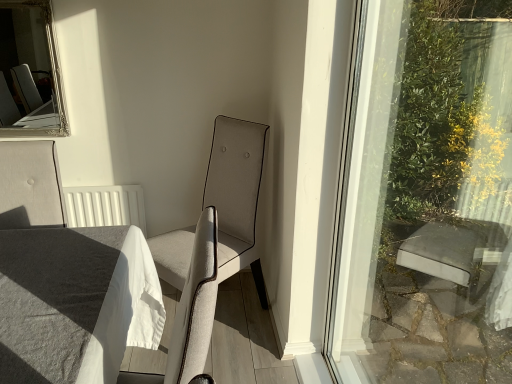
Question: Should I look upward or downward to see white linen table at lower left?

Choices:
 (A) down
 (B) up

Answer: (A)

Question: Can you confirm if silver/gilded mirror at upper left is taller than light beige fabric chair at center?

Choices:
 (A) no
 (B) yes

Answer: (A)

Question: Is silver/gilded mirror at upper left not within light beige fabric chair at center?

Choices:
 (A) yes
 (B) no

Answer: (A)

Question: Can you confirm if silver/gilded mirror at upper left is shorter than light beige fabric chair at center?

Choices:
 (A) yes
 (B) no

Answer: (A)

Question: From the image's perspective, is silver/gilded mirror at upper left beneath light beige fabric chair at center?

Choices:
 (A) no
 (B) yes

Answer: (A)

Question: Is silver/gilded mirror at upper left at the right side of light beige fabric chair at center?

Choices:
 (A) yes
 (B) no

Answer: (B)

Question: Considering the relative sizes of silver/gilded mirror at upper left and light beige fabric chair at center in the image provided, is silver/gilded mirror at upper left bigger than light beige fabric chair at center?

Choices:
 (A) yes
 (B) no

Answer: (B)

Question: Is silver/gilded mirror at upper left a part of white linen table at lower left?

Choices:
 (A) no
 (B) yes

Answer: (A)

Question: Is white linen table at lower left closer to camera compared to silver/gilded mirror at upper left?

Choices:
 (A) no
 (B) yes

Answer: (B)

Question: Are white linen table at lower left and silver/gilded mirror at upper left located far from each other?

Choices:
 (A) no
 (B) yes

Answer: (B)

Question: Is white linen table at lower left bigger than silver/gilded mirror at upper left?

Choices:
 (A) no
 (B) yes

Answer: (B)

Question: Is white linen table at lower left to the right of silver/gilded mirror at upper left from the viewer's perspective?

Choices:
 (A) yes
 (B) no

Answer: (A)

Question: Is white linen table at lower left facing towards silver/gilded mirror at upper left?

Choices:
 (A) no
 (B) yes

Answer: (A)

Question: From a real-world perspective, is light beige fabric chair at center over white linen table at lower left?

Choices:
 (A) no
 (B) yes

Answer: (A)